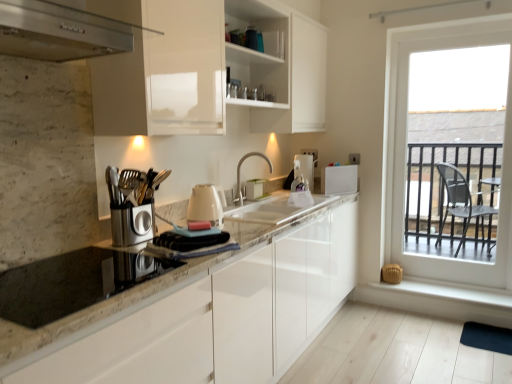
Question: Is white glossy cabinet at upper center positioned with its back to satin nickel faucet at center?

Choices:
 (A) yes
 (B) no

Answer: (B)

Question: Is white glossy cabinet at upper center further to the viewer compared to satin nickel faucet at center?

Choices:
 (A) yes
 (B) no

Answer: (B)

Question: From a real-world perspective, is white glossy cabinet at upper center on satin nickel faucet at center?

Choices:
 (A) no
 (B) yes

Answer: (B)

Question: From a real-world perspective, is white glossy cabinet at upper center beneath satin nickel faucet at center?

Choices:
 (A) yes
 (B) no

Answer: (B)

Question: Does white glossy cabinet at upper center turn towards satin nickel faucet at center?

Choices:
 (A) no
 (B) yes

Answer: (A)

Question: In terms of width, does dark blue rubber mat at lower right look wider or thinner when compared to white smooth window sill at lower right?

Choices:
 (A) wide
 (B) thin

Answer: (A)

Question: Is dark blue rubber mat at lower right bigger or smaller than white smooth window sill at lower right?

Choices:
 (A) big
 (B) small

Answer: (B)

Question: Is point (472, 329) closer or farther from the camera than point (500, 296)?

Choices:
 (A) closer
 (B) farther

Answer: (A)

Question: From the image's perspective, relative to white smooth window sill at lower right, is dark blue rubber mat at lower right above or below?

Choices:
 (A) below
 (B) above

Answer: (A)

Question: From a real-world perspective, relative to granite countertop at center, is white smooth window sill at lower right vertically above or below?

Choices:
 (A) below
 (B) above

Answer: (A)

Question: Is white smooth window sill at lower right bigger or smaller than granite countertop at center?

Choices:
 (A) small
 (B) big

Answer: (A)

Question: In terms of height, does white smooth window sill at lower right look taller or shorter compared to granite countertop at center?

Choices:
 (A) tall
 (B) short

Answer: (B)

Question: From the image's perspective, is white smooth window sill at lower right located above or below granite countertop at center?

Choices:
 (A) above
 (B) below

Answer: (B)

Question: Which is correct: granite countertop at center is inside white plastic toaster at upper right, the 3th appliance viewed from the front, or outside of it?

Choices:
 (A) inside
 (B) outside

Answer: (B)

Question: Is point (320, 302) positioned closer to the camera than point (351, 190)?

Choices:
 (A) closer
 (B) farther

Answer: (A)